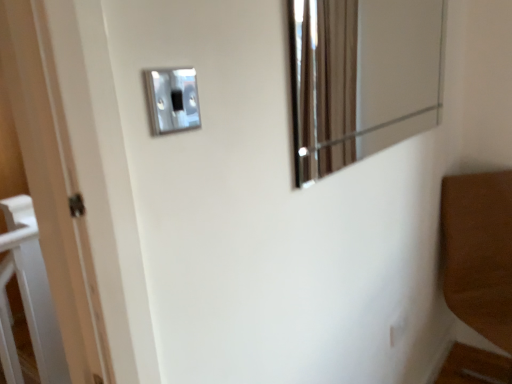
Question: Are metallic reflective mirror at upper right and satin silver switch at upper center, which is the 2th light switch from front to back, making contact?

Choices:
 (A) yes
 (B) no

Answer: (B)

Question: From a real-world perspective, is metallic reflective mirror at upper right positioned over satin silver switch at upper center, positioned as the first light switch in bottom-to-top order, based on gravity?

Choices:
 (A) yes
 (B) no

Answer: (A)

Question: Is metallic reflective mirror at upper right far from satin silver switch at upper center, the second light switch viewed from the top?

Choices:
 (A) no
 (B) yes

Answer: (B)

Question: Does metallic reflective mirror at upper right appear on the right side of satin silver switch at upper center, the 1th light switch from the right?

Choices:
 (A) yes
 (B) no

Answer: (B)

Question: From the image's perspective, is metallic reflective mirror at upper right above satin silver switch at upper center, the 1th light switch from the right?

Choices:
 (A) no
 (B) yes

Answer: (B)

Question: From the image's perspective, is satin silver switch at upper center, marked as the 2th light switch in a bottom-to-top arrangement, located above or below metallic reflective mirror at upper right?

Choices:
 (A) above
 (B) below

Answer: (B)

Question: Is satin silver switch at upper center, the first light switch positioned from the front, bigger or smaller than metallic reflective mirror at upper right?

Choices:
 (A) big
 (B) small

Answer: (B)

Question: From a real-world perspective, relative to metallic reflective mirror at upper right, is satin silver switch at upper center, the first light switch positioned from the front, vertically above or below?

Choices:
 (A) above
 (B) below

Answer: (B)

Question: Is satin silver switch at upper center, the 1th light switch in the top-to-bottom sequence, spatially inside metallic reflective mirror at upper right, or outside of it?

Choices:
 (A) inside
 (B) outside

Answer: (B)

Question: In the image, is satin silver switch at upper center, positioned as the first light switch in bottom-to-top order, positioned in front of or behind satin silver switch at upper center, marked as the 2th light switch in a bottom-to-top arrangement?

Choices:
 (A) behind
 (B) front

Answer: (A)

Question: From the image's perspective, relative to satin silver switch at upper center, the first light switch positioned from the front, is satin silver switch at upper center, which is the first light switch from back to front, above or below?

Choices:
 (A) above
 (B) below

Answer: (B)

Question: From their relative heights in the image, would you say satin silver switch at upper center, the 2th light switch when ordered from left to right, is taller or shorter than satin silver switch at upper center, which appears as the 1th light switch when viewed from the left?

Choices:
 (A) tall
 (B) short

Answer: (B)

Question: Looking at their shapes, would you say satin silver switch at upper center, the second light switch viewed from the top, is wider or thinner than satin silver switch at upper center, the 2th light switch positioned from the back?

Choices:
 (A) wide
 (B) thin

Answer: (B)

Question: Is point (338, 97) closer or farther from the camera than point (156, 84)?

Choices:
 (A) closer
 (B) farther

Answer: (B)

Question: From a real-world perspective, relative to satin silver switch at upper center, the 1th light switch in the top-to-bottom sequence, is metallic reflective mirror at upper right vertically above or below?

Choices:
 (A) below
 (B) above

Answer: (B)